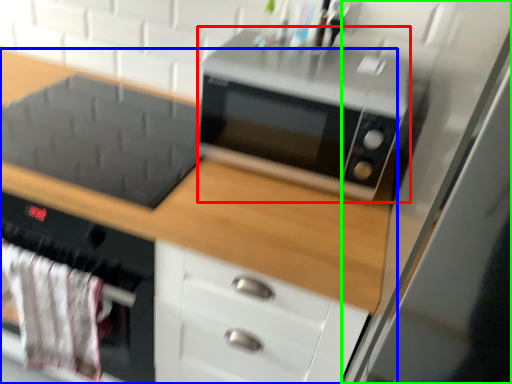
Question: Which is nearer to the microwave oven (highlighted by a red box)? cabinetry (highlighted by a blue box) or glass door (highlighted by a green box).

Choices:
 (A) cabinetry
 (B) glass door

Answer: (A)